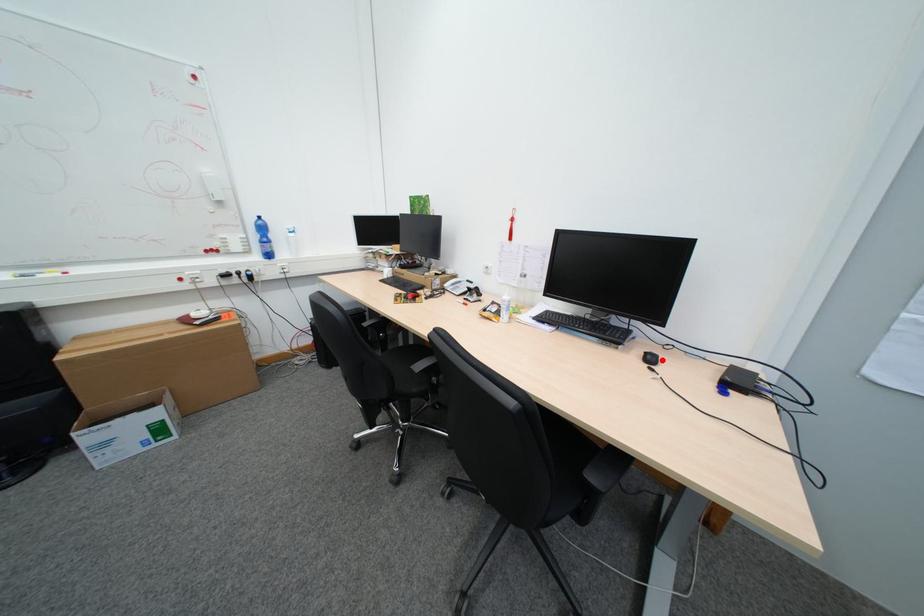
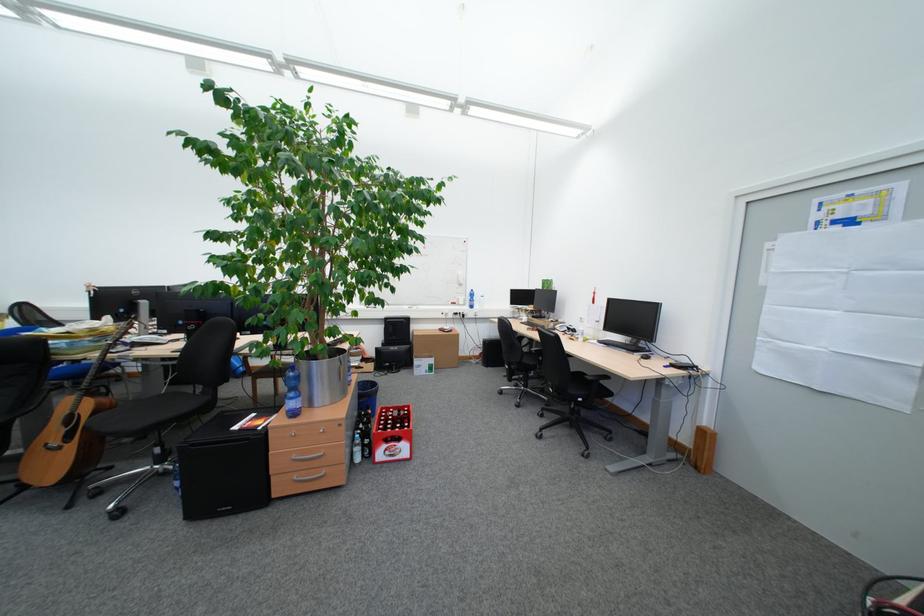
In the second image, find the point that corresponds to the highlighted location in the first image.

(658, 359)